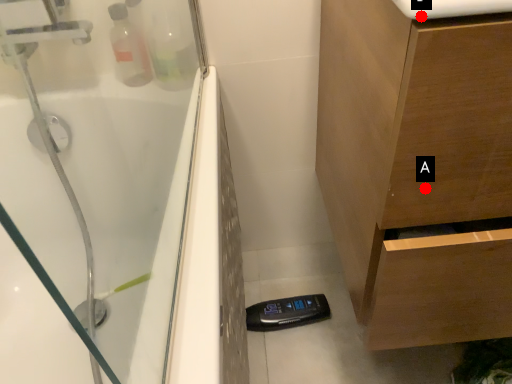
Question: Two points are circled on the image, labeled by A and B beside each circle. Which point appears closest to the camera in this image?

Choices:
 (A) A is closer
 (B) B is closer

Answer: (B)